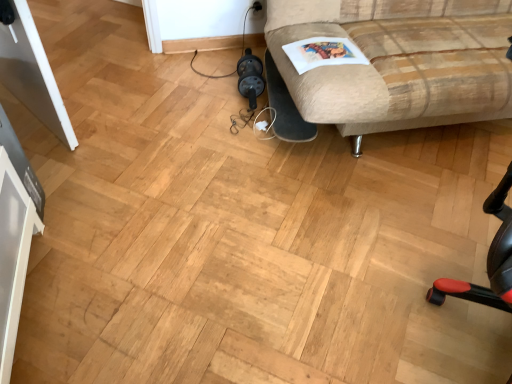
Question: Considering the relative positions of beige fabric couch at upper right and white paper magazine at upper right in the image provided, is beige fabric couch at upper right in front of white paper magazine at upper right?

Choices:
 (A) no
 (B) yes

Answer: (B)

Question: Is the position of beige fabric couch at upper right more distant than that of white paper magazine at upper right?

Choices:
 (A) yes
 (B) no

Answer: (B)

Question: Considering the relative sizes of beige fabric couch at upper right and white paper magazine at upper right in the image provided, is beige fabric couch at upper right wider than white paper magazine at upper right?

Choices:
 (A) no
 (B) yes

Answer: (B)

Question: Is beige fabric couch at upper right with white paper magazine at upper right?

Choices:
 (A) no
 (B) yes

Answer: (A)

Question: Can you confirm if beige fabric couch at upper right is positioned to the left of white paper magazine at upper right?

Choices:
 (A) no
 (B) yes

Answer: (A)

Question: Is beige fabric couch at upper right shorter than white paper magazine at upper right?

Choices:
 (A) yes
 (B) no

Answer: (B)

Question: Is white paper magazine at upper right facing away from beige fabric couch at upper right?

Choices:
 (A) no
 (B) yes

Answer: (B)

Question: Is white paper magazine at upper right next to beige fabric couch at upper right and touching it?

Choices:
 (A) yes
 (B) no

Answer: (B)

Question: Does white paper magazine at upper right appear on the right side of beige fabric couch at upper right?

Choices:
 (A) no
 (B) yes

Answer: (A)

Question: Considering the relative sizes of white paper magazine at upper right and beige fabric couch at upper right in the image provided, is white paper magazine at upper right shorter than beige fabric couch at upper right?

Choices:
 (A) yes
 (B) no

Answer: (A)

Question: Is white paper magazine at upper right wider than beige fabric couch at upper right?

Choices:
 (A) yes
 (B) no

Answer: (B)

Question: From the image's perspective, is white paper magazine at upper right on top of beige fabric couch at upper right?

Choices:
 (A) no
 (B) yes

Answer: (A)

Question: Is white paper magazine at upper right to the left or to the right of beige fabric couch at upper right in the image?

Choices:
 (A) left
 (B) right

Answer: (A)